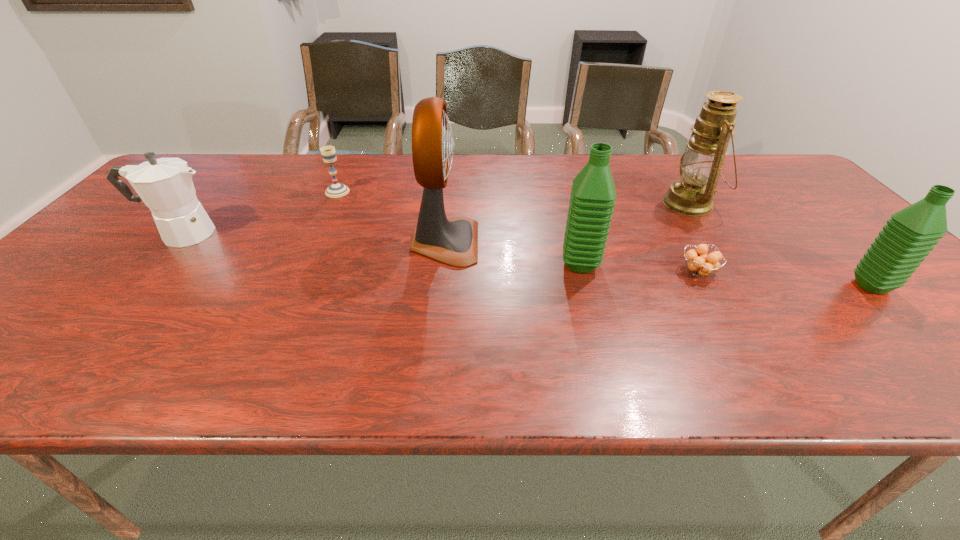
At what (x,y) coordinates should I click in order to perform the action: click on vacant position located on the left of the left water bottle. Please return your answer as a coordinate pair (x, y). The width and height of the screenshot is (960, 540). Looking at the image, I should click on (465, 264).

Find the location of `vacant space located 0.360m on the left of the right water bottle`. vacant space located 0.360m on the left of the right water bottle is located at coordinates (696, 286).

The width and height of the screenshot is (960, 540). What are the coordinates of `vacant space located on the left of the sixth object from right to left` in the screenshot? It's located at (309, 192).

Locate an element on the screen. blank space located 0.380m on the back of the shortest object is located at coordinates (647, 183).

At what (x,y) coordinates should I click in order to perform the action: click on blank space located 0.290m on the left of the oil lamp. Please return your answer as a coordinate pair (x, y). The image size is (960, 540). Looking at the image, I should click on (564, 204).

Image resolution: width=960 pixels, height=540 pixels. Identify the location of vacant space located on the front-facing side of the fifth object from right to left. (513, 242).

The height and width of the screenshot is (540, 960). Find the location of `vacant space located at the spout of the leftmost object`. vacant space located at the spout of the leftmost object is located at coordinates (279, 234).

At what (x,y) coordinates should I click in order to perform the action: click on chalice that is at the far edge. Please return your answer as a coordinate pair (x, y). The height and width of the screenshot is (540, 960). Looking at the image, I should click on (328, 153).

You are a GUI agent. You are given a task and a screenshot of the screen. Output one action in this format:
    pyautogui.click(x=<x>, y=<y>)
    Task: Click on the oil lamp at the far edge
    This screenshot has height=540, width=960.
    Given the screenshot: What is the action you would take?
    pyautogui.click(x=700, y=165)

Find the location of `object situated at the left edge`. object situated at the left edge is located at coordinates (165, 185).